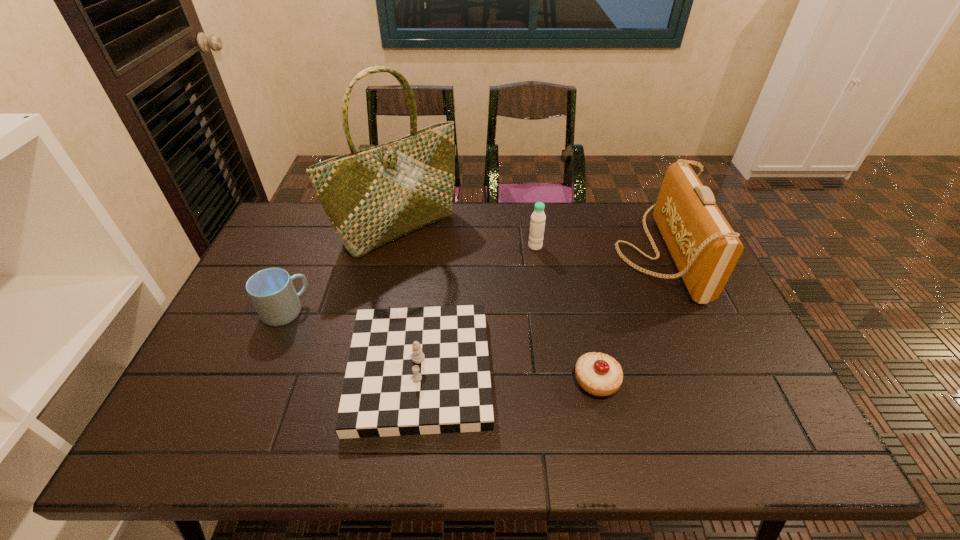
Find the location of `free spot between the tallest object and the handbag`. free spot between the tallest object and the handbag is located at coordinates (529, 241).

The height and width of the screenshot is (540, 960). I want to click on free point between the fourth shortest object and the shopping bag, so click(x=468, y=238).

At what (x,y) coordinates should I click in order to perform the action: click on empty space between the fifth shortest object and the leftmost object. Please return your answer as a coordinate pair (x, y). The image size is (960, 540). Looking at the image, I should click on (471, 282).

At what (x,y) coordinates should I click in order to perform the action: click on empty space that is in between the shopping bag and the third tallest object. Please return your answer as a coordinate pair (x, y). The height and width of the screenshot is (540, 960). Looking at the image, I should click on (468, 238).

At what (x,y) coordinates should I click in order to perform the action: click on free space between the tallest object and the leftmost object. Please return your answer as a coordinate pair (x, y). This screenshot has height=540, width=960. Looking at the image, I should click on (342, 271).

The image size is (960, 540). In order to click on free space between the checkerboard and the rightmost object in this screenshot , I will do `click(540, 311)`.

Identify the location of free area in between the mug and the second tallest object. This screenshot has width=960, height=540. [x=471, y=282].

Locate which object ranks second in proximity to the checkerboard. Please provide its 2D coordinates. Your answer should be formatted as a tuple, i.e. [(x, y)], where the tuple contains the x and y coordinates of a point satisfying the conditions above.

[(599, 374)]

Locate which object ranks in proximity to the handbag. Please provide its 2D coordinates. Your answer should be formatted as a tuple, i.e. [(x, y)], where the tuple contains the x and y coordinates of a point satisfying the conditions above.

[(599, 374)]

Where is `free spot that satisfies the following two spatial constraints: 1. on the back side of the tallest object; 2. on the left side of the leftmost object`? This screenshot has height=540, width=960. free spot that satisfies the following two spatial constraints: 1. on the back side of the tallest object; 2. on the left side of the leftmost object is located at coordinates (321, 229).